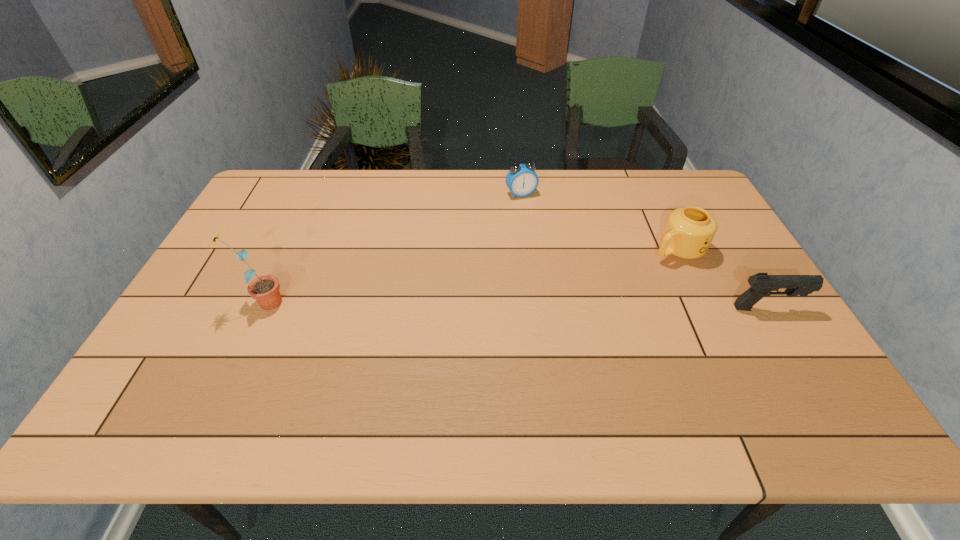
Locate an element on the screen. The width and height of the screenshot is (960, 540). blank space at the near left corner is located at coordinates (191, 363).

The width and height of the screenshot is (960, 540). Find the location of `vacant space that's between the alarm clock and the sunflower`. vacant space that's between the alarm clock and the sunflower is located at coordinates (392, 248).

Identify the location of free point between the pistol and the mug. (722, 279).

Find the location of a particular element. The height and width of the screenshot is (540, 960). empty space between the mug and the farthest object is located at coordinates (599, 222).

You are a GUI agent. You are given a task and a screenshot of the screen. Output one action in this format:
    pyautogui.click(x=<x>, y=<y>)
    Task: Click on the free spot between the pistol and the mug
    Image resolution: width=960 pixels, height=540 pixels.
    Given the screenshot: What is the action you would take?
    pyautogui.click(x=722, y=279)

Image resolution: width=960 pixels, height=540 pixels. I want to click on vacant region between the pistol and the leftmost object, so click(515, 306).

I want to click on vacant space that's between the pistol and the sunflower, so click(x=515, y=306).

The height and width of the screenshot is (540, 960). I want to click on vacant space that's between the third nearest object and the farthest object, so click(599, 222).

Find the location of a particular element. free space between the sunflower and the pistol is located at coordinates (515, 306).

The height and width of the screenshot is (540, 960). What are the coordinates of `vacant area that lies between the second farthest object and the tallest object` in the screenshot? It's located at (469, 276).